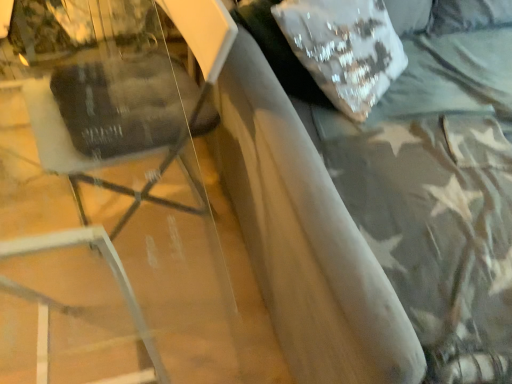
You are a GUI agent. You are given a task and a screenshot of the screen. Output one action in this format:
    pyautogui.click(x=<x>, y=<y>)
    Task: Click on the white sequined pillow at upper right
    
    Given the screenshot: What is the action you would take?
    pyautogui.click(x=344, y=49)

Locate an element on the screen. Image resolution: width=512 pixels, height=384 pixels. suede-like gray bed at upper right is located at coordinates (380, 199).

Which of these two, white sequined pillow at upper right or matte black swivel chair at left, is thinner?

white sequined pillow at upper right.

Does white sequined pillow at upper right appear on the left side of matte black swivel chair at left?

Incorrect, white sequined pillow at upper right is not on the left side of matte black swivel chair at left.

Can you confirm if white sequined pillow at upper right is shorter than matte black swivel chair at left?

Correct, white sequined pillow at upper right is not as tall as matte black swivel chair at left.

Is white sequined pillow at upper right spatially inside matte black swivel chair at left, or outside of it?

white sequined pillow at upper right is not inside matte black swivel chair at left, it's outside.

From the image's perspective, which object appears higher, white sequined pillow at upper right or suede-like gray bed at upper right?

white sequined pillow at upper right.

Is point (380, 90) behind point (322, 102)?

No, (380, 90) is in front of (322, 102).

Who is shorter, white sequined pillow at upper right or suede-like gray bed at upper right?

With less height is white sequined pillow at upper right.

Which is in front, white sequined pillow at upper right or suede-like gray bed at upper right?

suede-like gray bed at upper right is in front.

In the scene shown: From a real-world perspective, relative to white sequined pillow at upper right, is matte black swivel chair at left vertically above or below?

matte black swivel chair at left is situated lower than white sequined pillow at upper right in the real world.

Between matte black swivel chair at left and white sequined pillow at upper right, which one has larger size?

matte black swivel chair at left.

Is matte black swivel chair at left to the right of white sequined pillow at upper right from the viewer's perspective?

No, matte black swivel chair at left is not to the right of white sequined pillow at upper right.

Is point (129, 211) closer or farther from the camera than point (318, 35)?

Point (129, 211) is farther from the camera than point (318, 35).

Does suede-like gray bed at upper right have a greater height compared to matte black swivel chair at left?

Indeed, suede-like gray bed at upper right has a greater height compared to matte black swivel chair at left.

Are suede-like gray bed at upper right and matte black swivel chair at left beside each other?

There is a gap between suede-like gray bed at upper right and matte black swivel chair at left.

Looking at this image, is suede-like gray bed at upper right further to camera compared to matte black swivel chair at left?

No, the depth of suede-like gray bed at upper right is less than that of matte black swivel chair at left.

Is suede-like gray bed at upper right looking in the opposite direction of white sequined pillow at upper right?

Yes, white sequined pillow at upper right is at the back of suede-like gray bed at upper right.

In the scene shown: Is suede-like gray bed at upper right outside of white sequined pillow at upper right?

Yes, suede-like gray bed at upper right is located beyond the bounds of white sequined pillow at upper right.

Is suede-like gray bed at upper right bigger or smaller than white sequined pillow at upper right?

Considering their sizes, suede-like gray bed at upper right takes up more space than white sequined pillow at upper right.

Considering the relative sizes of suede-like gray bed at upper right and white sequined pillow at upper right in the image provided, is suede-like gray bed at upper right shorter than white sequined pillow at upper right?

No.

Between matte black swivel chair at left and suede-like gray bed at upper right, which one has smaller size?

matte black swivel chair at left.

Where is `swivel chair that appears below the suede-like gray bed at upper right (from a real-world perspective)`? Image resolution: width=512 pixels, height=384 pixels. swivel chair that appears below the suede-like gray bed at upper right (from a real-world perspective) is located at coordinates (117, 83).

Find the location of `pillow above the matte black swivel chair at left (from the image's perspective)`. pillow above the matte black swivel chair at left (from the image's perspective) is located at coordinates (344, 49).

Find the location of `pillow above the suede-like gray bed at upper right (from a real-world perspective)`. pillow above the suede-like gray bed at upper right (from a real-world perspective) is located at coordinates (344, 49).

From the image, which object appears to be nearer to white sequined pillow at upper right, matte black swivel chair at left or suede-like gray bed at upper right?

suede-like gray bed at upper right is positioned closer to the anchor white sequined pillow at upper right.

When comparing their distances from matte black swivel chair at left, does suede-like gray bed at upper right or white sequined pillow at upper right seem further?

white sequined pillow at upper right is positioned further to the anchor matte black swivel chair at left.

Which object lies nearer to the anchor point matte black swivel chair at left, white sequined pillow at upper right or suede-like gray bed at upper right?

suede-like gray bed at upper right is positioned closer to the anchor matte black swivel chair at left.

When comparing their distances from suede-like gray bed at upper right, does matte black swivel chair at left or white sequined pillow at upper right seem closer?

white sequined pillow at upper right.

When comparing their distances from white sequined pillow at upper right, does suede-like gray bed at upper right or matte black swivel chair at left seem further?

Based on the image, matte black swivel chair at left appears to be further to white sequined pillow at upper right.

In the scene shown: Considering their positions, is white sequined pillow at upper right positioned closer to suede-like gray bed at upper right than matte black swivel chair at left?

Among the two, white sequined pillow at upper right is located nearer to suede-like gray bed at upper right.

Locate an element on the screen. The height and width of the screenshot is (384, 512). pillow between matte black swivel chair at left and suede-like gray bed at upper right in the horizontal direction is located at coordinates (344, 49).